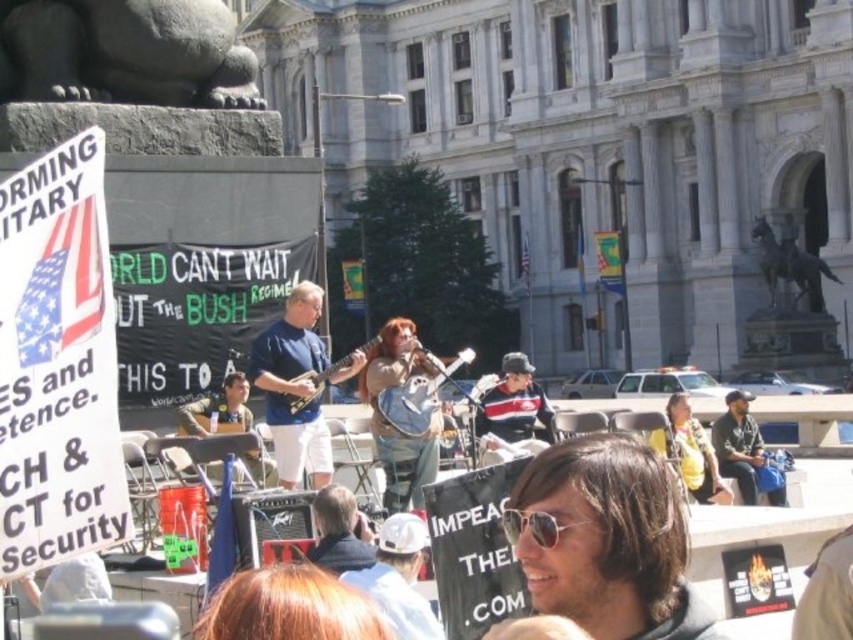
You are a photographer at the protest scene. You want to take a photo that includes both the sunglasses at center and the black fabric cap at right. Based on their positions, which object should you adjust your camera to focus on first to ensure both are in frame?

The sunglasses at center is positioned on the left side of black fabric cap at right. To include both in the frame, focus on the sunglasses at center first since it is closer to the left edge, then adjust to include the black fabric cap at right.

You are a photographer positioned at the origin of the coordinate system. You need to capture a photo of the sunglasses at center. What are the coordinates where you should aim your camera?

The sunglasses at center is located at point (606, 540), so you should aim your camera at those coordinates to capture it.

You are a photographer at the protest scene. You need to capture a closeup shot of both the sunglasses at center and the black fabric cap at right. Given that your camera can only focus on one object at a time, which object would you choose to ensure the subject is fully in frame without cropping?

The sunglasses at center has a larger width than the black fabric cap at right. To ensure both are fully in frame without cropping, you should focus on the sunglasses at center first since it requires more space, then adjust for the black fabric cap at right.